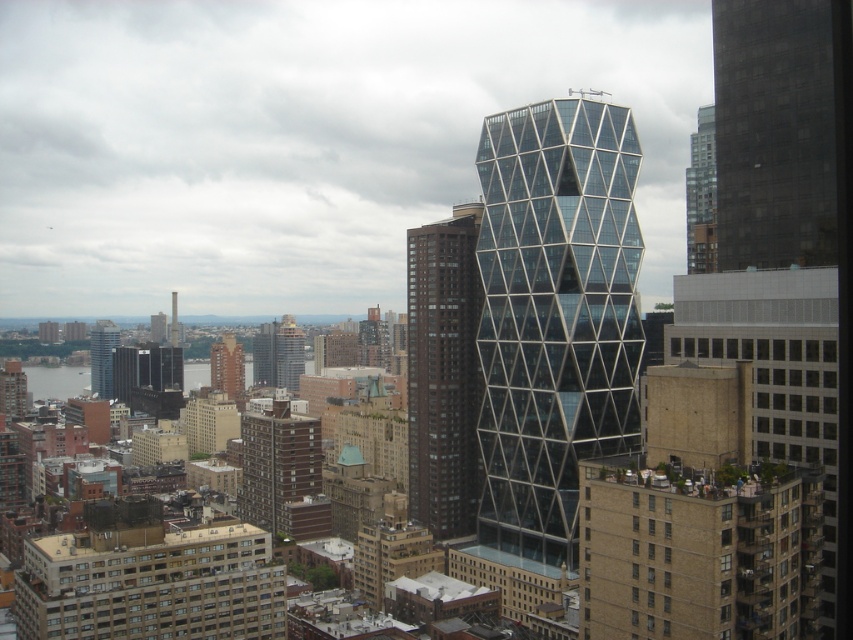
Question: Which of the following is the closest to the observer?

Choices:
 (A) glassy steel tower at center
 (B) dark gray concrete building at right

Answer: (B)

Question: Which object is positioned closest to the dark gray concrete building at right?

Choices:
 (A) brick building at center
 (B) brown glassy building at center

Answer: (B)

Question: Which of the following is the farthest from the observer?

Choices:
 (A) dark gray concrete building at right
 (B) brown brick building at upper right
 (C) matte glass skyscraper at left

Answer: (C)

Question: Observing the image, what is the correct spatial positioning of dark gray concrete building at right in reference to brown brick building at center?

Choices:
 (A) left
 (B) right

Answer: (B)

Question: Is brown brick building at center wider than matte glass skyscraper at left?

Choices:
 (A) no
 (B) yes

Answer: (B)

Question: Is brown brick building at center bigger than brick building at center?

Choices:
 (A) yes
 (B) no

Answer: (A)